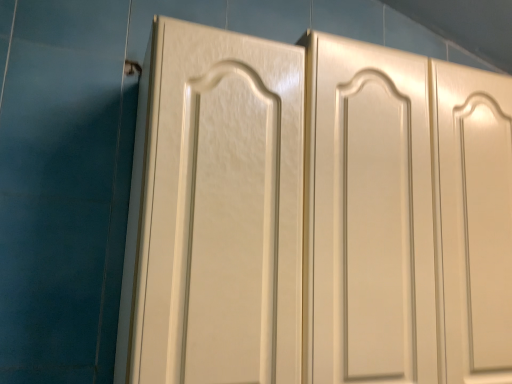
The height and width of the screenshot is (384, 512). What do you see at coordinates (280, 212) in the screenshot? I see `matte white cabinet at left` at bounding box center [280, 212].

Where is `matte white cabinet at left`? The image size is (512, 384). matte white cabinet at left is located at coordinates (280, 212).

Identify the location of matte white cabinet at left. [x=280, y=212].